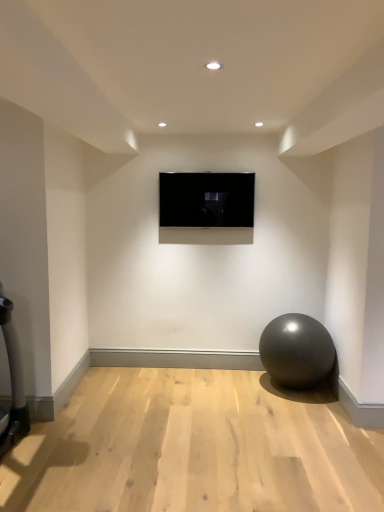
This screenshot has height=512, width=384. I want to click on vacant area situated below matte black screen at center (from a real-world perspective), so click(208, 365).